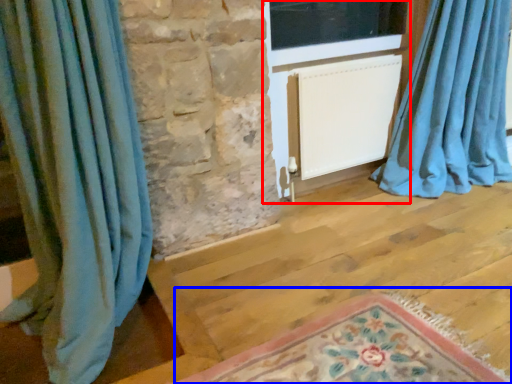
Question: Among these objects, which one is farthest to the camera, screen door (highlighted by a red box) or mat (highlighted by a blue box)?

Choices:
 (A) screen door
 (B) mat

Answer: (A)